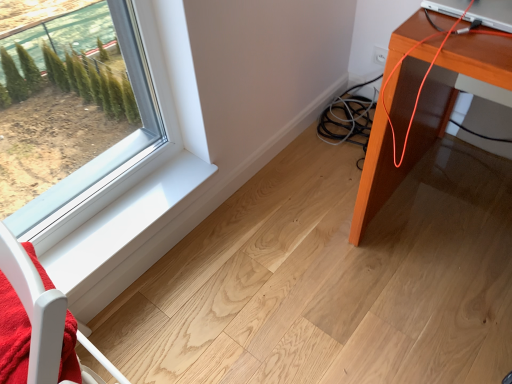
Identify the location of vacant area situated to the left side of orange wood table at right. (307, 241).